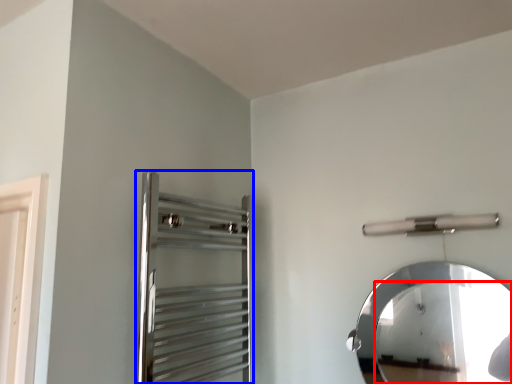
Question: Which object appears farthest to the camera in this image, mirror (highlighted by a red box) or screen door (highlighted by a blue box)?

Choices:
 (A) mirror
 (B) screen door

Answer: (A)